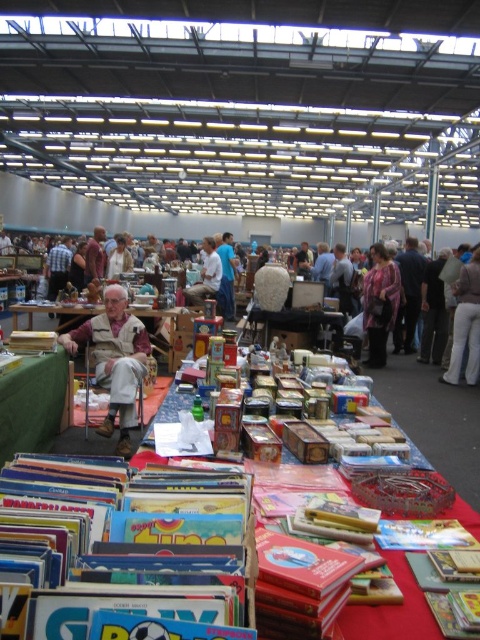
You are standing at the entrance of the flea market and want to find the red fabric tablecloth at center. According to the coordinates given, in which direction should you move relative to your current position to reach it?

The red fabric tablecloth at center is located at coordinates point [435,419]. Since the coordinate system typically places [0,0] at the bottom left corner and [479,639] at the top right corner, moving towards higher x and y values would mean moving to the right and upwards. However, since you are at the entrance, which is likely at the bottom edge, you should move forward towards the center area while slightly to the right to reach the red fabric tablecloth at center.

You are standing at the entrance of the flea market and want to locate the green fabric table at center. According to the coordinates provided, where should you look relative to your position?

The green fabric table at center is located at coordinates point (169, 330), which means it is positioned slightly to the right and above your central line of sight.

You are a vendor at the flea market and want to place a large decorative item on the table. You have a red fabric tablecloth at center and a patterned fabric jacket at center on the table. Which item should you use as a base if you need a wider surface area?

The red fabric tablecloth at center might be wider than patterned fabric jacket at center, so you should use the red fabric tablecloth at center as the base for the large decorative item to ensure sufficient width.